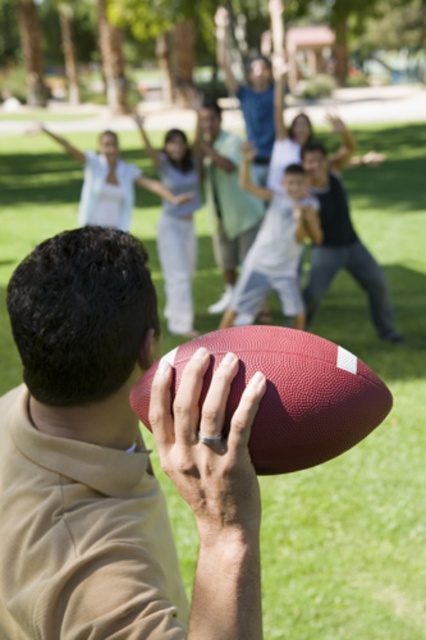
Based on the scene description, which object is smaller in size between the leather textured football at center and the light blue cotton shirt at upper center?

The leather textured football at center is smaller than the light blue cotton shirt at upper center according to the description.

You are a photographer trying to capture a group photo of the matte black shirt at center and the light blue cotton shirt at upper center. Which one should you zoom in on to ensure both are in focus?

The matte black shirt at center is bigger than the light blue cotton shirt at upper center, so you should zoom in on the matte black shirt at center to ensure both are in focus.

You are a photographer standing at the edge of the park. You want to take a photo that includes both the leather textured football at center and the light blue shirt at center. The camera has a maximum focus range of 7 meters. Will both subjects be in focus if you try to capture them together?

The leather textured football at center and the light blue shirt at center are 7.53 meters apart from each other. Since the camera can only focus within 7 meters, the distance between them exceeds the maximum focus range. Therefore, both subjects cannot be in focus simultaneously.